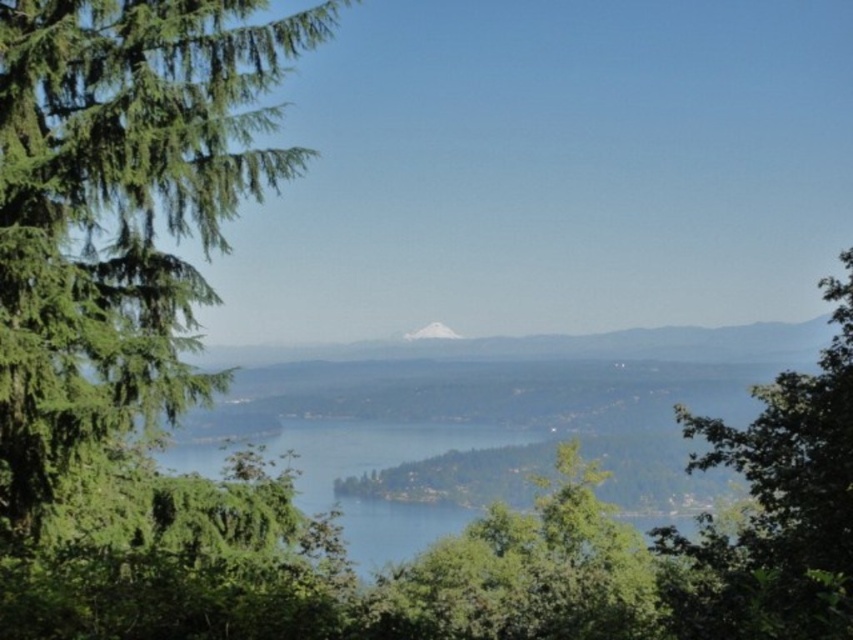
Question: Which object is closer to the camera taking this photo?

Choices:
 (A) green leafy tree at left
 (B) green leafy tree at right
 (C) green leafy tree at center

Answer: (B)

Question: Is green leafy tree at right above white snow-covered mountain at center?

Choices:
 (A) no
 (B) yes

Answer: (A)

Question: Is green leafy tree at right further to the viewer compared to white snow-covered mountain at center?

Choices:
 (A) yes
 (B) no

Answer: (B)

Question: Which object appears closest to the camera in this image?

Choices:
 (A) green leafy tree at right
 (B) green leafy tree at center
 (C) green leafy tree at left
 (D) white snow-covered mountain at center

Answer: (A)

Question: Is green leafy tree at left in front of green leafy tree at right?

Choices:
 (A) no
 (B) yes

Answer: (A)

Question: Which of the following is the farthest from the observer?

Choices:
 (A) (811, 499)
 (B) (572, 609)
 (C) (134, 410)

Answer: (B)